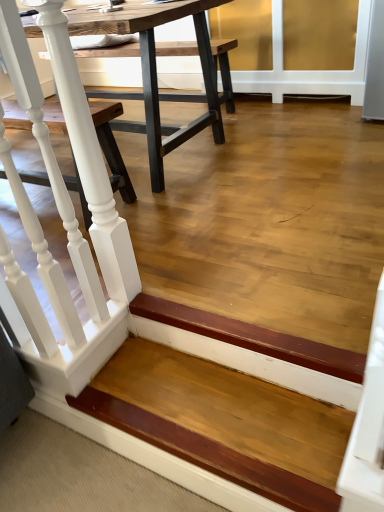
Question: From the image's perspective, is wooden step at lower left on wooden table at center?

Choices:
 (A) no
 (B) yes

Answer: (A)

Question: From the image's perspective, is wooden step at lower left under wooden table at center?

Choices:
 (A) no
 (B) yes

Answer: (B)

Question: Considering the relative positions of wooden step at lower left and wooden table at center in the image provided, is wooden step at lower left to the right of wooden table at center from the viewer's perspective?

Choices:
 (A) yes
 (B) no

Answer: (A)

Question: Is wooden step at lower left far from wooden table at center?

Choices:
 (A) no
 (B) yes

Answer: (B)

Question: Does wooden step at lower left appear on the left side of wooden table at center?

Choices:
 (A) no
 (B) yes

Answer: (A)

Question: In terms of height, does white painted wood railing at left look taller or shorter compared to wooden step at lower left?

Choices:
 (A) tall
 (B) short

Answer: (A)

Question: Considering the relative positions of white painted wood railing at left and wooden step at lower left in the image provided, is white painted wood railing at left to the left or to the right of wooden step at lower left?

Choices:
 (A) right
 (B) left

Answer: (B)

Question: Choose the correct answer: Is white painted wood railing at left inside wooden step at lower left or outside it?

Choices:
 (A) outside
 (B) inside

Answer: (A)

Question: Is white painted wood railing at left in front of or behind wooden step at lower left in the image?

Choices:
 (A) behind
 (B) front

Answer: (B)

Question: Choose the correct answer: Is wooden step at lower left inside wooden table at center or outside it?

Choices:
 (A) inside
 (B) outside

Answer: (B)

Question: From a real-world perspective, is wooden step at lower left above or below wooden table at center?

Choices:
 (A) below
 (B) above

Answer: (A)

Question: Considering the positions of wooden step at lower left and wooden table at center in the image, is wooden step at lower left wider or thinner than wooden table at center?

Choices:
 (A) thin
 (B) wide

Answer: (A)

Question: Is wooden step at lower left in front of or behind wooden table at center in the image?

Choices:
 (A) behind
 (B) front

Answer: (B)

Question: From the image's perspective, is white painted wood railing at left located above or below wooden table at center?

Choices:
 (A) below
 (B) above

Answer: (A)

Question: In the image, is white painted wood railing at left positioned in front of or behind wooden table at center?

Choices:
 (A) front
 (B) behind

Answer: (A)